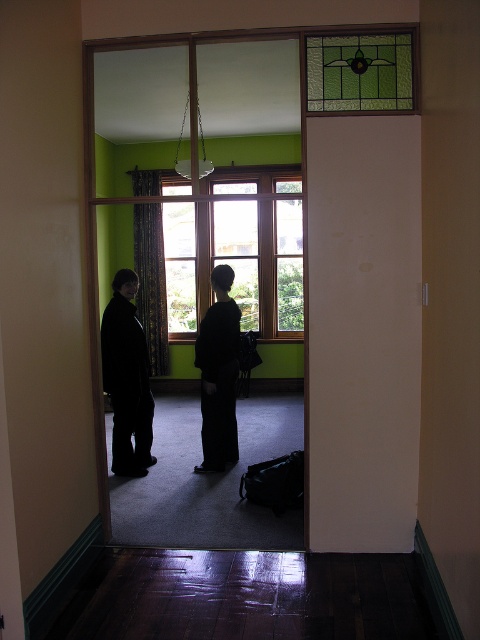
Who is shorter, wooden frame window at center or black matte coat at center?

Standing shorter between the two is black matte coat at center.

Does wooden frame window at center have a smaller size compared to black matte coat at center?

No, wooden frame window at center is not smaller than black matte coat at center.

Is point (184, 252) positioned in front of point (116, 396)?

No, (184, 252) is further to viewer.

Locate an element on the screen. This screenshot has width=480, height=640. wooden frame window at center is located at coordinates (236, 262).

From the picture: Who is higher up, wooden frame window at center or black fabric couple at center?

wooden frame window at center

Image resolution: width=480 pixels, height=640 pixels. Describe the element at coordinates (236, 262) in the screenshot. I see `wooden frame window at center` at that location.

The height and width of the screenshot is (640, 480). In order to click on wooden frame window at center in this screenshot , I will do `click(236, 262)`.

Does black fabric couple at center appear on the left side of black matte coat at center?

No, black fabric couple at center is not to the left of black matte coat at center.

At what (x,y) coordinates should I click in order to perform the action: click on black fabric couple at center. Please return your answer as a coordinate pair (x, y). The image size is (480, 640). Looking at the image, I should click on (127, 380).

Image resolution: width=480 pixels, height=640 pixels. In order to click on black fabric couple at center in this screenshot , I will do `click(127, 380)`.